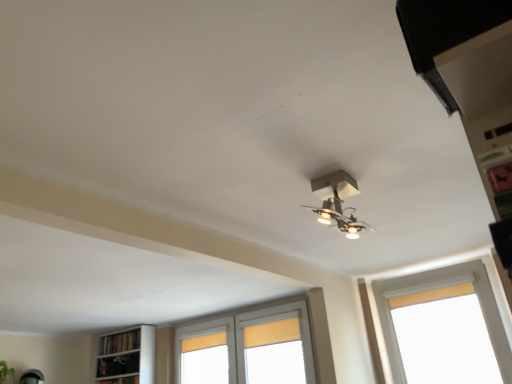
Question: Does black matte exhaust hood at upper right have a greater height compared to white painted wood window at right, arranged as the 1th window when viewed from the right?

Choices:
 (A) no
 (B) yes

Answer: (A)

Question: Considering the relative sizes of black matte exhaust hood at upper right and white painted wood window at right, the 2th window in the left-to-right sequence, in the image provided, is black matte exhaust hood at upper right bigger than white painted wood window at right, the 2th window in the left-to-right sequence,?

Choices:
 (A) yes
 (B) no

Answer: (B)

Question: Can you confirm if black matte exhaust hood at upper right is positioned to the left of white painted wood window at right, arranged as the 1th window when viewed from the right?

Choices:
 (A) yes
 (B) no

Answer: (A)

Question: Is black matte exhaust hood at upper right wider than white painted wood window at right, which is the first window in front-to-back order?

Choices:
 (A) no
 (B) yes

Answer: (A)

Question: Is black matte exhaust hood at upper right directly adjacent to white painted wood window at right, which is the first window in front-to-back order?

Choices:
 (A) yes
 (B) no

Answer: (B)

Question: From the image's perspective, is black matte exhaust hood at upper right located above or below metallic silver light fixture at center?

Choices:
 (A) above
 (B) below

Answer: (A)

Question: Is black matte exhaust hood at upper right taller or shorter than metallic silver light fixture at center?

Choices:
 (A) short
 (B) tall

Answer: (A)

Question: Considering the positions of black matte exhaust hood at upper right and metallic silver light fixture at center in the image, is black matte exhaust hood at upper right wider or thinner than metallic silver light fixture at center?

Choices:
 (A) thin
 (B) wide

Answer: (A)

Question: Considering the relative positions of black matte exhaust hood at upper right and metallic silver light fixture at center in the image provided, is black matte exhaust hood at upper right to the left or to the right of metallic silver light fixture at center?

Choices:
 (A) left
 (B) right

Answer: (A)

Question: Visually, is black matte exhaust hood at upper right positioned to the left or to the right of white wooden window at center, which is the 1th window in back-to-front order?

Choices:
 (A) right
 (B) left

Answer: (A)

Question: Choose the correct answer: Is black matte exhaust hood at upper right inside white wooden window at center, acting as the 1th window starting from the left, or outside it?

Choices:
 (A) inside
 (B) outside

Answer: (B)

Question: From their relative heights in the image, would you say black matte exhaust hood at upper right is taller or shorter than white wooden window at center, which is the 1th window in back-to-front order?

Choices:
 (A) tall
 (B) short

Answer: (B)

Question: Does point (452, 29) appear closer or farther from the camera than point (229, 367)?

Choices:
 (A) farther
 (B) closer

Answer: (B)

Question: In terms of height, does metallic silver light fixture at center look taller or shorter compared to wooden bookshelf at lower left?

Choices:
 (A) short
 (B) tall

Answer: (B)

Question: Considering the positions of metallic silver light fixture at center and wooden bookshelf at lower left in the image, is metallic silver light fixture at center wider or thinner than wooden bookshelf at lower left?

Choices:
 (A) wide
 (B) thin

Answer: (A)